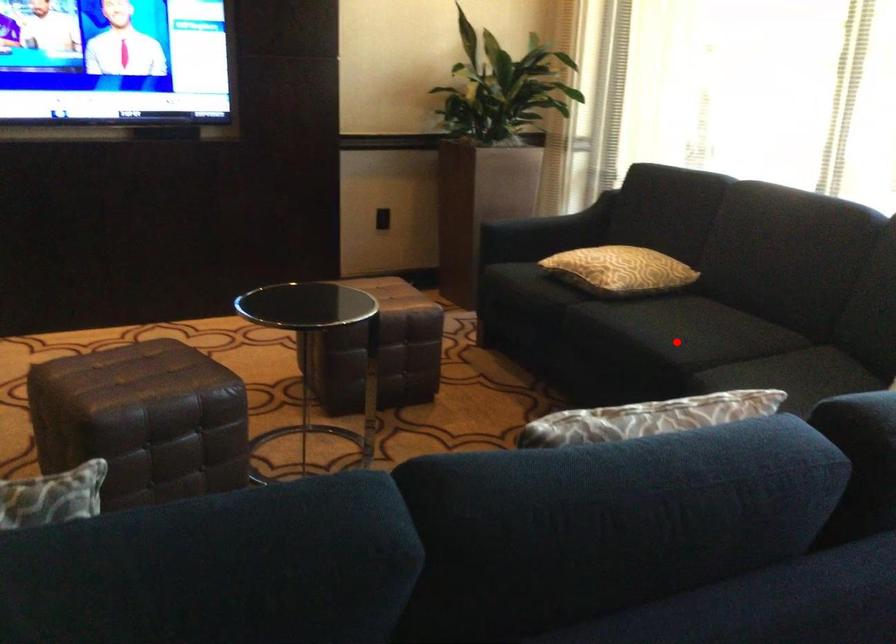
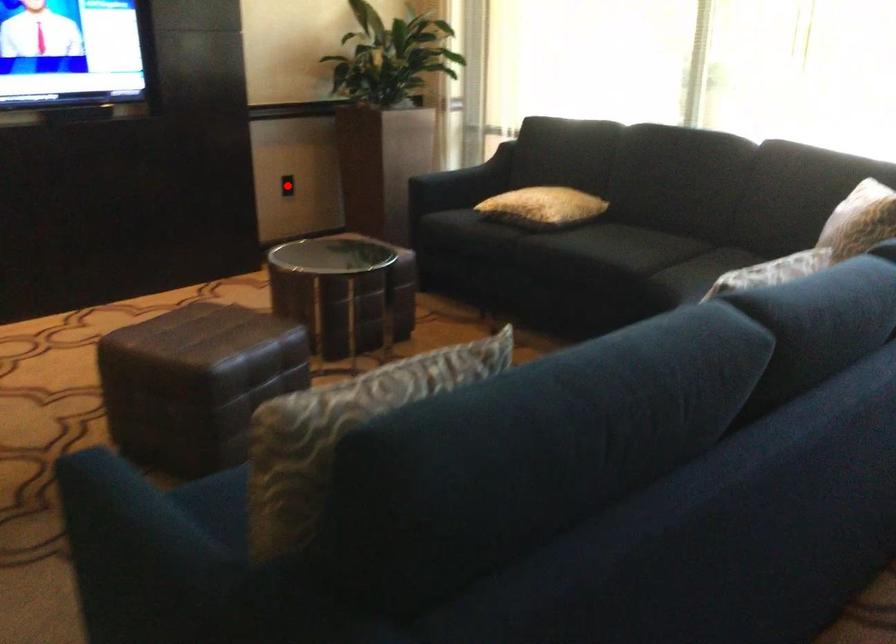
I am providing you with two images of the same scene from different viewpoints. A red point is marked on the first image and another point is marked on the second image. Do the highlighted points in image1 and image2 indicate the same real-world spot?

No